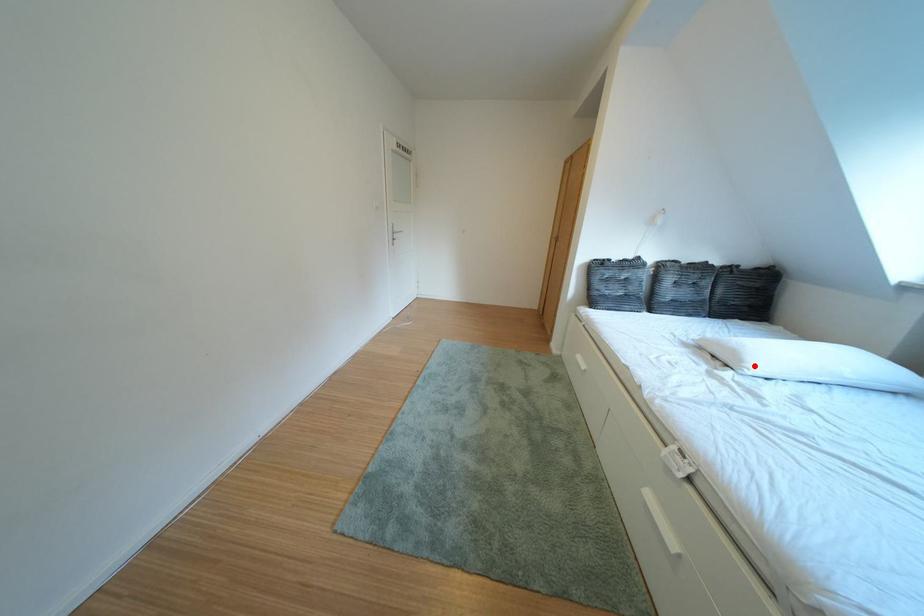
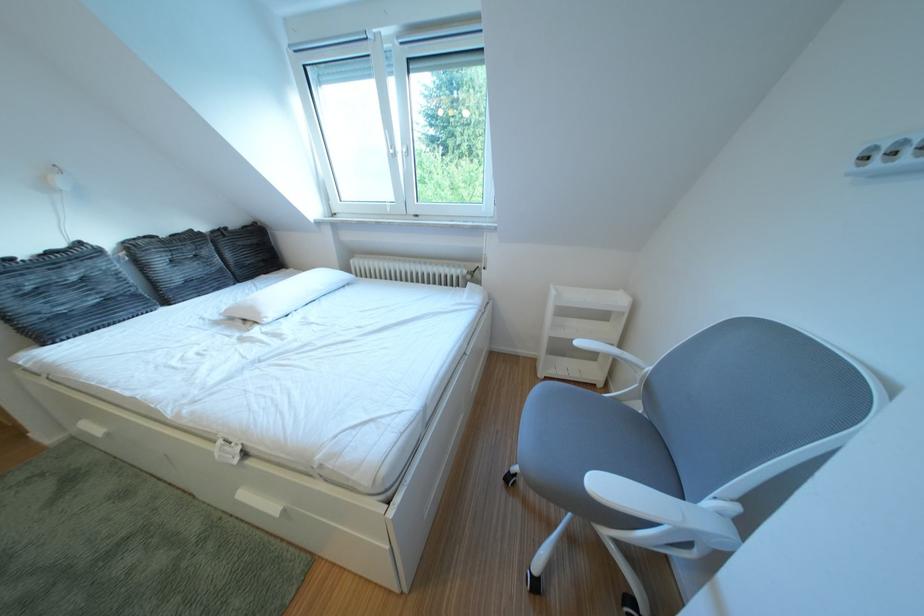
Question: I am providing you with two images of the same scene from different viewpoints. A red point is shown in image1. For the corresponding object point in image2, is it positioned nearer or farther from the camera?

Choices:
 (A) Nearer
 (B) Farther

Answer: (A)